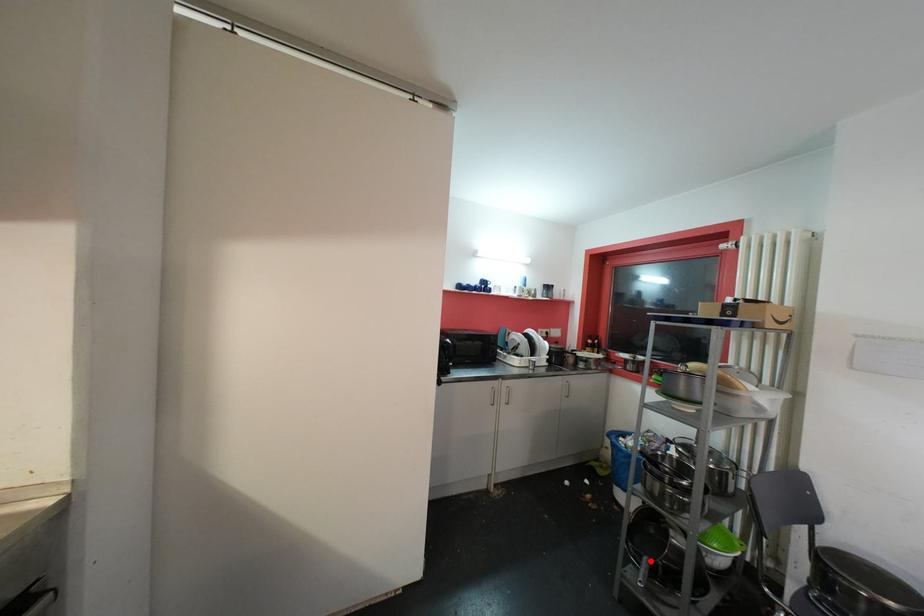
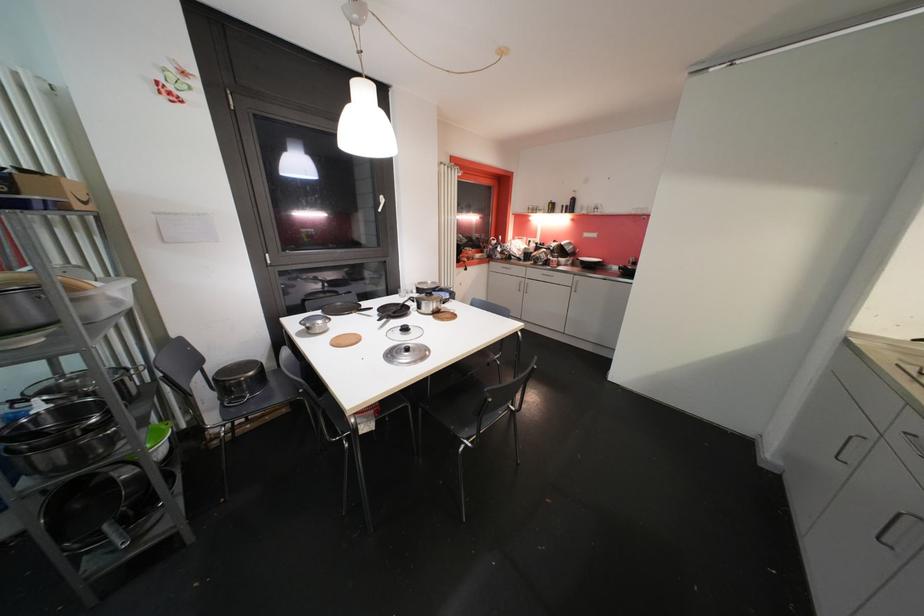
Question: A red point is marked in image1. In image2, is the corresponding 3D point closer to the camera or farther? Reply with the corresponding letter.

Choices:
 (A) The corresponding 3D point is closer.
 (B) The corresponding 3D point is farther.

Answer: (A)